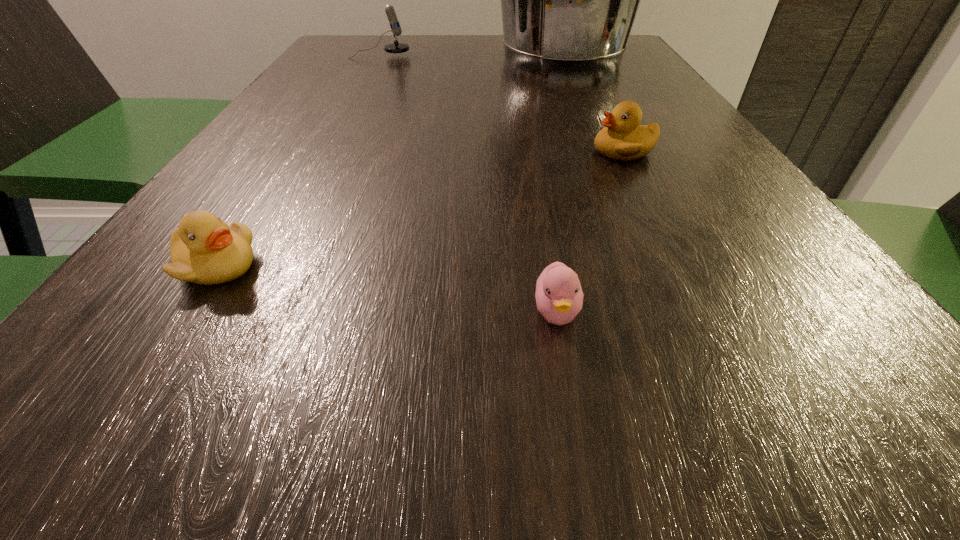
Where is `vacant space situated 0.050m at the beak of the rightmost duckling`? This screenshot has width=960, height=540. vacant space situated 0.050m at the beak of the rightmost duckling is located at coordinates (564, 151).

Find the location of `free region located 0.350m on the beak of the leftmost duckling`. free region located 0.350m on the beak of the leftmost duckling is located at coordinates pos(541,267).

I want to click on vacant space located on the front-facing side of the second duckling from left to right, so click(569, 382).

Locate an element on the screen. bucket present at the far edge is located at coordinates (569, 0).

The width and height of the screenshot is (960, 540). Identify the location of microphone that is at the far edge. (396, 47).

Where is `microphone that is at the left edge`? microphone that is at the left edge is located at coordinates (396, 47).

Where is `duckling at the left edge`? duckling at the left edge is located at coordinates (204, 250).

In order to click on bucket present at the right edge in this screenshot , I will do `click(569, 0)`.

Image resolution: width=960 pixels, height=540 pixels. I want to click on duckling located in the right edge section of the desktop, so click(623, 138).

Locate an element on the screen. The width and height of the screenshot is (960, 540). object at the far left corner is located at coordinates (396, 47).